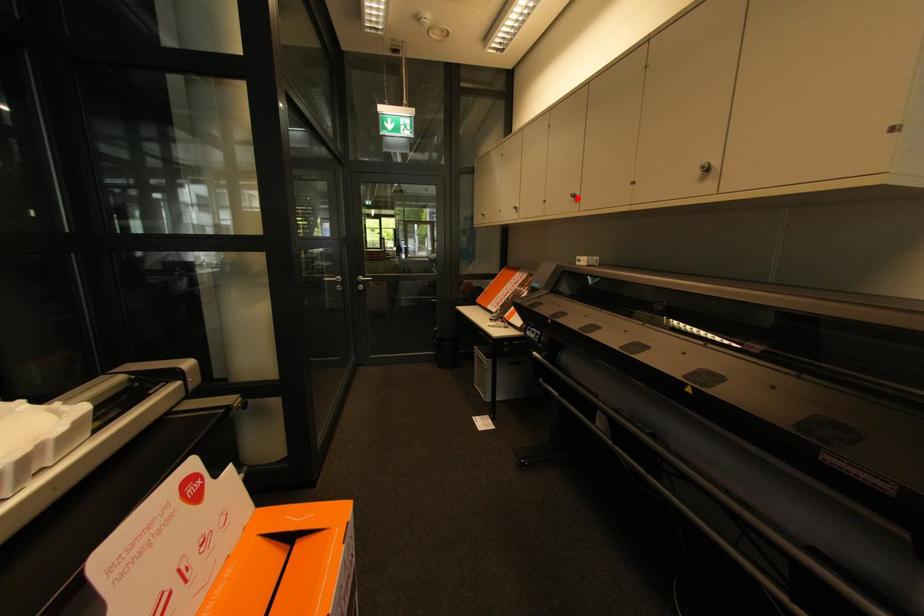
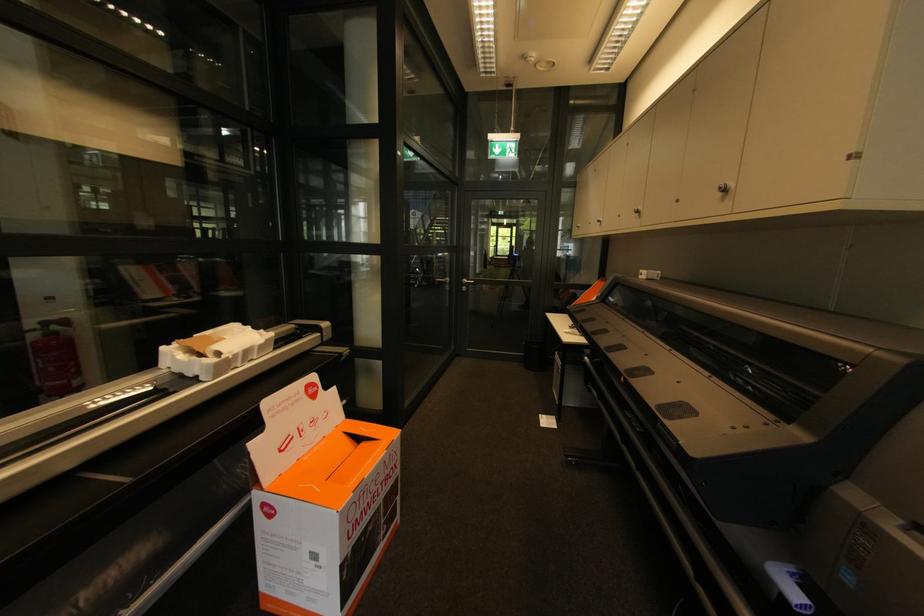
Locate, in the second image, the point that corresponds to the highlighted location in the first image.

(640, 214)